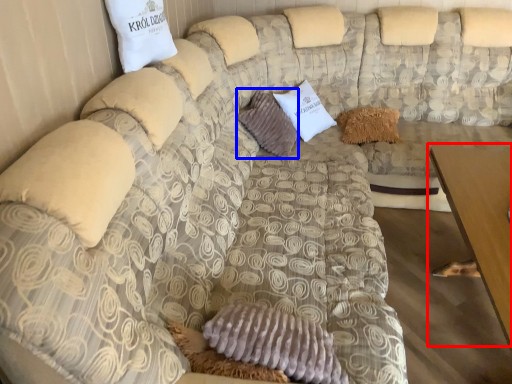
Question: Which object is further to the camera taking this photo, table (highlighted by a red box) or pillow (highlighted by a blue box)?

Choices:
 (A) table
 (B) pillow

Answer: (B)